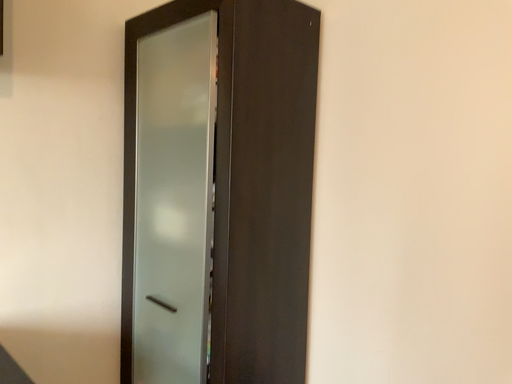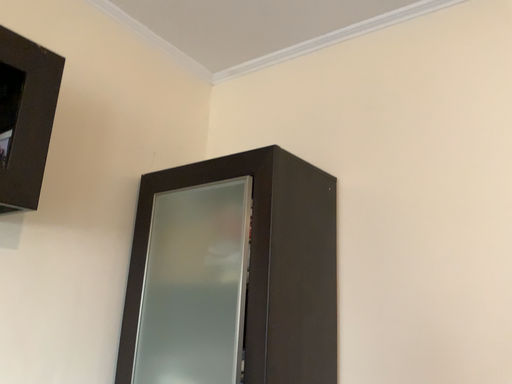
Question: How did the camera likely rotate when shooting the video?

Choices:
 (A) rotated right
 (B) rotated left

Answer: (A)